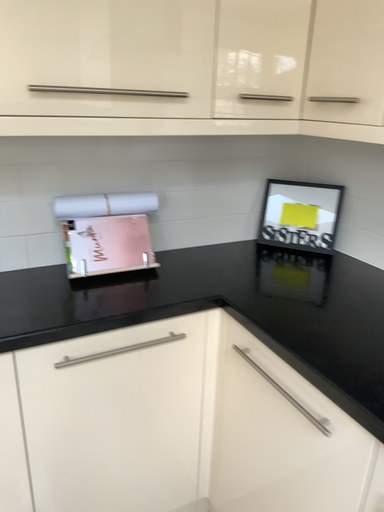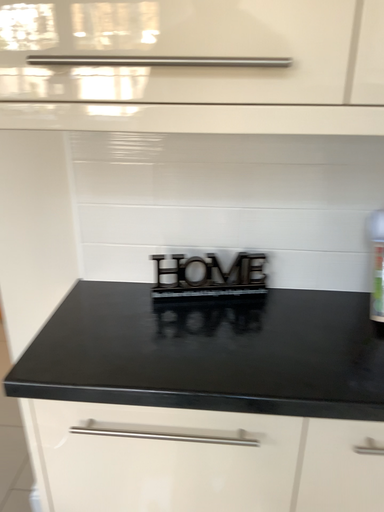
Question: How did the camera likely rotate when shooting the video?

Choices:
 (A) rotated left
 (B) rotated right

Answer: (A)